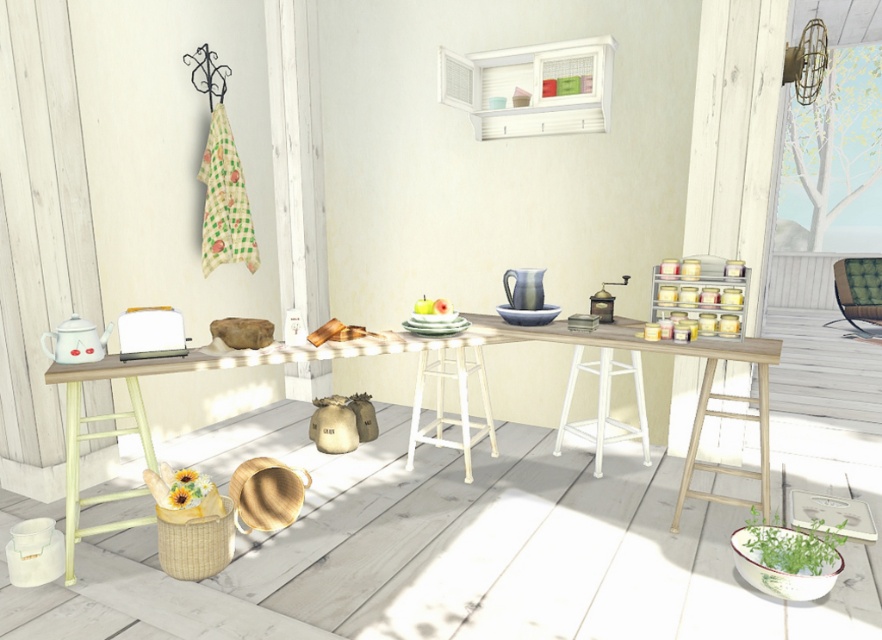
You are a guest entering the kitchen and want to sit down on the white plastic stool at center. However, you notice the wooden table at left is in the way. Can you move the stool to the right to make space for yourself?

The wooden table at left is positioned over white plastic stool at center, so the stool is underneath the table. To move the stool to the right, you need to first slide the table to the left or lift the stool carefully from under the table.

You are sitting in the green fabric chair at right and want to place a teacup on the wooden table at left. Can you reach the table without getting up?

The wooden table at left is positioned under the green fabric chair at right, so you can easily reach it without getting up.

You are planning to place a small decorative vase on the wooden table at left and the white plastic stool at center. Which surface can accommodate the vase without it being too small?

The wooden table at left is larger in size than the white plastic stool at center, so the vase can be placed on the wooden table at left without being too small.